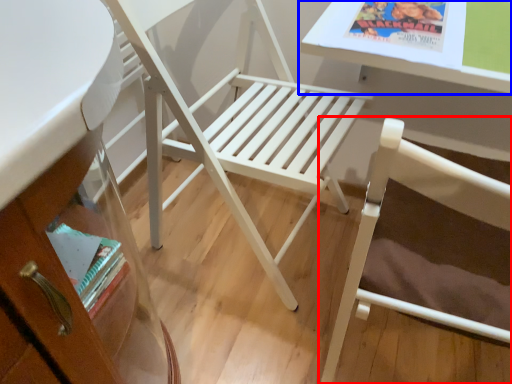
Question: Which object appears farthest to the camera in this image, chair (highlighted by a red box) or table (highlighted by a blue box)?

Choices:
 (A) chair
 (B) table

Answer: (B)